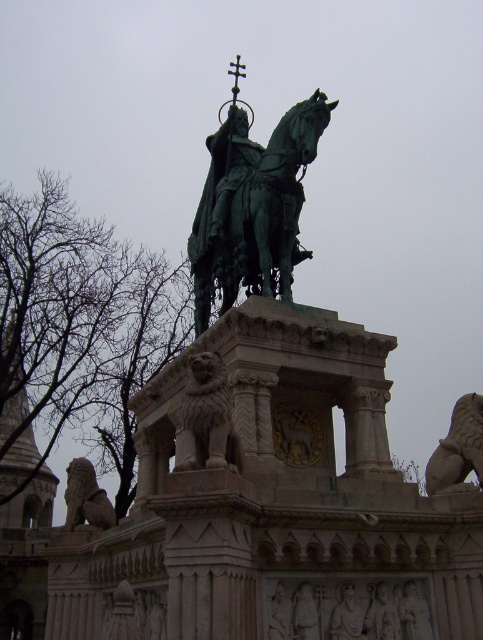
You are an art student analyzing the statue arrangement. The scene has a green polished metal horse at center and a gray stone lion at center. Based on their positions, which object is closer to the viewer?

The green polished metal horse at center is closer to the viewer since the gray stone lion at center is positioned behind it.